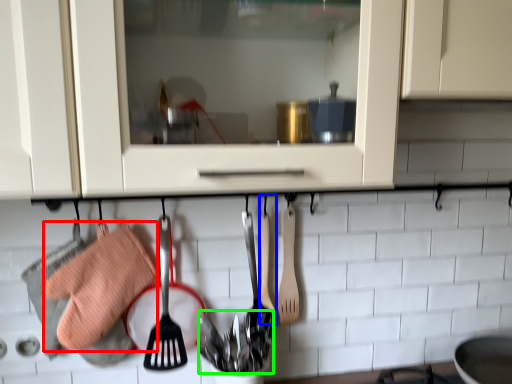
Question: Which object is the farthest from material (highlighted by a red box)? Choose among these: spatula (highlighted by a blue box) or silverware (highlighted by a green box).

Choices:
 (A) spatula
 (B) silverware

Answer: (A)